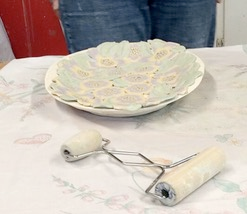
Image resolution: width=247 pixels, height=214 pixels. I want to click on red furniture, so click(37, 23).